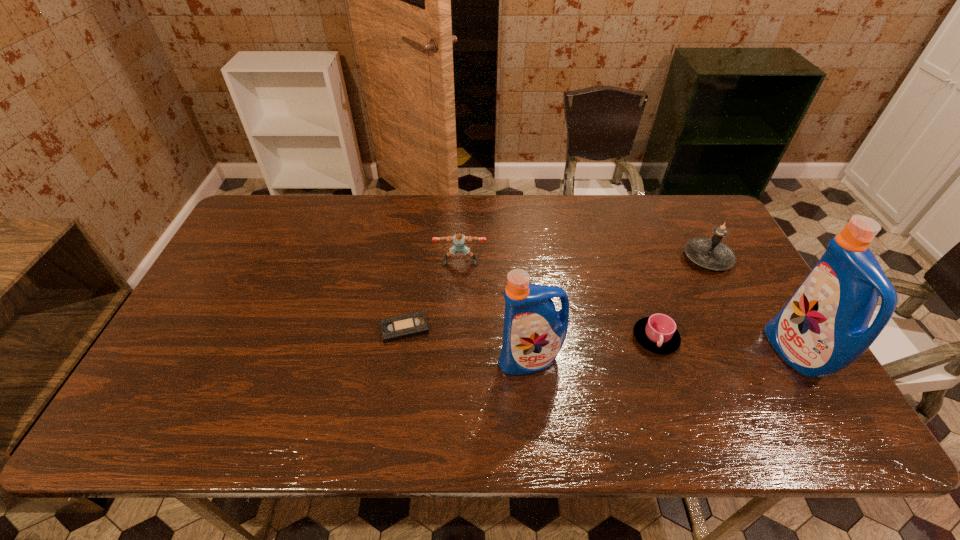
This screenshot has height=540, width=960. Identify the location of free point that keeps the detergents evenly spaced on the left. (258, 367).